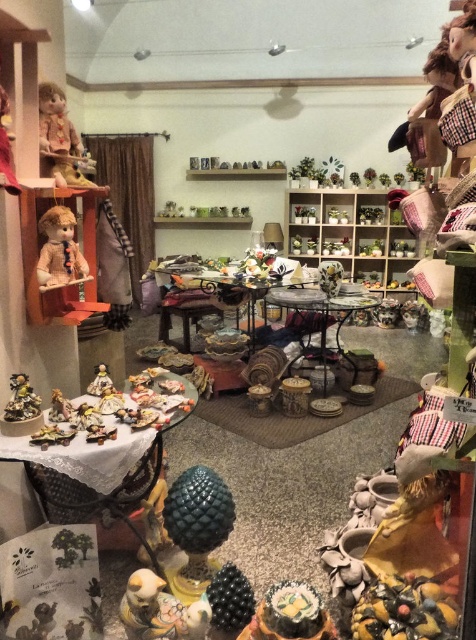
Who is positioned more to the left, wooden doll at left or matte porcelain figurine at center?

Positioned to the left is wooden doll at left.

Between point (71, 205) and point (56, 401), which one is positioned in front?

Point (56, 401) is more forward.

Describe the element at coordinates (40, 248) in the screenshot. I see `wooden doll at left` at that location.

You are a GUI agent. You are given a task and a screenshot of the screen. Output one action in this format:
    pyautogui.click(x=<x>, y=<y>)
    Task: Click on the wooden doll at left
    The image size is (476, 640).
    Given the screenshot: What is the action you would take?
    pyautogui.click(x=40, y=248)

Which is below, white lace tablecloth at lower left or matte brown doll at left?

white lace tablecloth at lower left is lower down.

Does white lace tablecloth at lower left have a lesser width compared to matte brown doll at left?

In fact, white lace tablecloth at lower left might be wider than matte brown doll at left.

At what (x,y) coordinates should I click in order to perform the action: click on white lace tablecloth at lower left. Please return your answer as a coordinate pair (x, y). Image resolution: width=476 pixels, height=640 pixels. Looking at the image, I should click on (15, 476).

Does matte brown doll at left appear over wooden table at center?

Yes.

Which is behind, point (39, 264) or point (170, 307)?

The point (170, 307) is more distant.

At what (x,y) coordinates should I click in order to perform the action: click on matte brown doll at left. Please return your answer as a coordinate pair (x, y). This screenshot has width=476, height=640. Looking at the image, I should click on (59, 248).